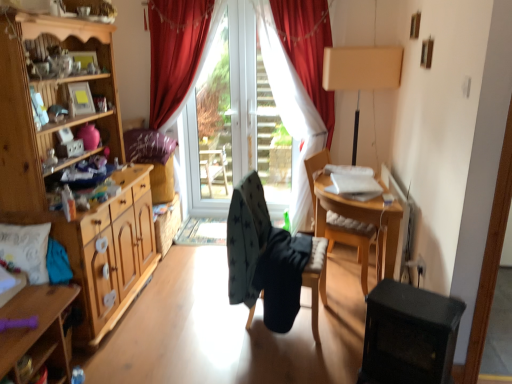
Question: Is wooden table at center not inside transparent glass door at center?

Choices:
 (A) yes
 (B) no

Answer: (A)

Question: Does wooden table at center come behind transparent glass door at center?

Choices:
 (A) yes
 (B) no

Answer: (B)

Question: Does wooden table at center have a greater height compared to transparent glass door at center?

Choices:
 (A) yes
 (B) no

Answer: (B)

Question: Is wooden table at center facing away from transparent glass door at center?

Choices:
 (A) yes
 (B) no

Answer: (B)

Question: Is wooden table at center aimed at transparent glass door at center?

Choices:
 (A) yes
 (B) no

Answer: (B)

Question: Considering their positions, is red velvet curtain at center located in front of or behind wooden cabinet at left?

Choices:
 (A) behind
 (B) front

Answer: (A)

Question: From their relative heights in the image, would you say red velvet curtain at center is taller or shorter than wooden cabinet at left?

Choices:
 (A) short
 (B) tall

Answer: (B)

Question: Is red velvet curtain at center wider or thinner than wooden cabinet at left?

Choices:
 (A) wide
 (B) thin

Answer: (B)

Question: Visually, is red velvet curtain at center positioned to the left or to the right of wooden cabinet at left?

Choices:
 (A) right
 (B) left

Answer: (A)

Question: Would you say white textured pillow at left, the first pillow when ordered from front to back, is to the left or to the right of beige fabric lampshade at upper right in the picture?

Choices:
 (A) left
 (B) right

Answer: (A)

Question: From the image's perspective, is white textured pillow at left, positioned as the first pillow in bottom-to-top order, positioned above or below beige fabric lampshade at upper right?

Choices:
 (A) below
 (B) above

Answer: (A)

Question: Is point (12, 259) positioned closer to the camera than point (339, 84)?

Choices:
 (A) closer
 (B) farther

Answer: (A)

Question: In terms of height, does white textured pillow at left, which ranks as the second pillow in top-to-bottom order, look taller or shorter compared to beige fabric lampshade at upper right?

Choices:
 (A) short
 (B) tall

Answer: (A)

Question: Looking at their shapes, would you say beige fabric lampshade at upper right is wider or thinner than wooden chair at right, which ranks as the first chair in right-to-left order?

Choices:
 (A) thin
 (B) wide

Answer: (A)

Question: Is beige fabric lampshade at upper right taller or shorter than wooden chair at right, which ranks as the first chair in right-to-left order?

Choices:
 (A) tall
 (B) short

Answer: (A)